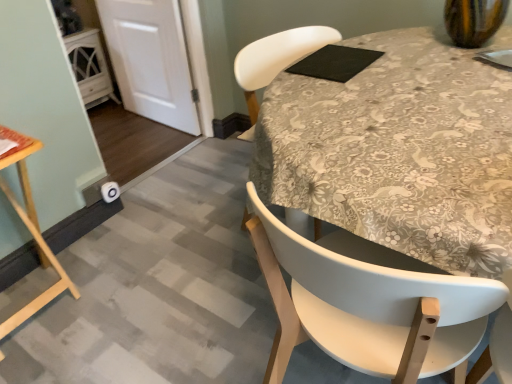
Question: Based on their sizes in the image, would you say white matte chair at center is bigger or smaller than floral fabric tablecloth at center?

Choices:
 (A) big
 (B) small

Answer: (A)

Question: Does point (458, 362) appear closer or farther from the camera than point (384, 122)?

Choices:
 (A) closer
 (B) farther

Answer: (A)

Question: Which is nearer to the wooden table at lower left?

Choices:
 (A) floral fabric tablecloth at center
 (B) white matte door at lower left
 (C) white matte chair at center
 (D) black matte pad at upper center

Answer: (C)

Question: Which is farther from the white matte door at lower left?

Choices:
 (A) white matte chair at center
 (B) black matte pad at upper center
 (C) floral fabric tablecloth at center
 (D) wooden table at lower left

Answer: (A)